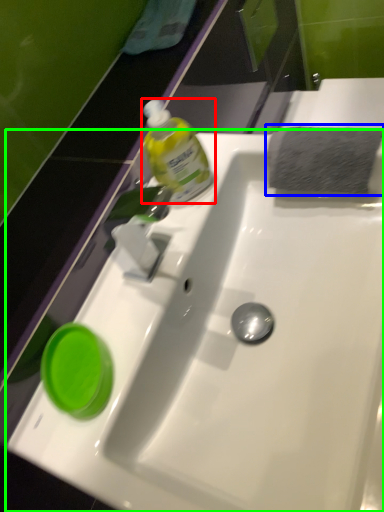
Question: Which is nearer to the bottle (highlighted by a red box)? hand towel (highlighted by a blue box) or sink (highlighted by a green box).

Choices:
 (A) hand towel
 (B) sink

Answer: (A)